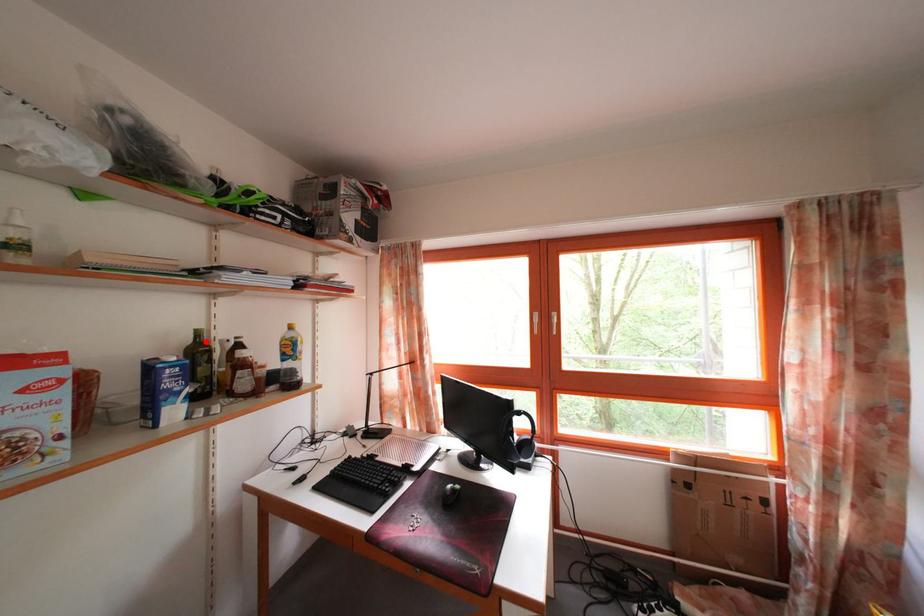
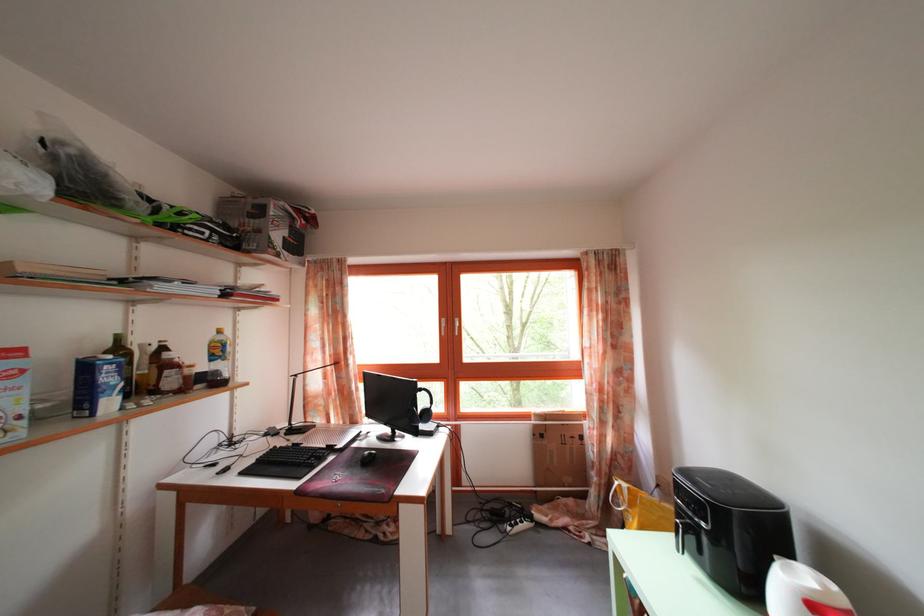
Find the pixel in the second image that matches the highlighted location in the first image.

(126, 346)